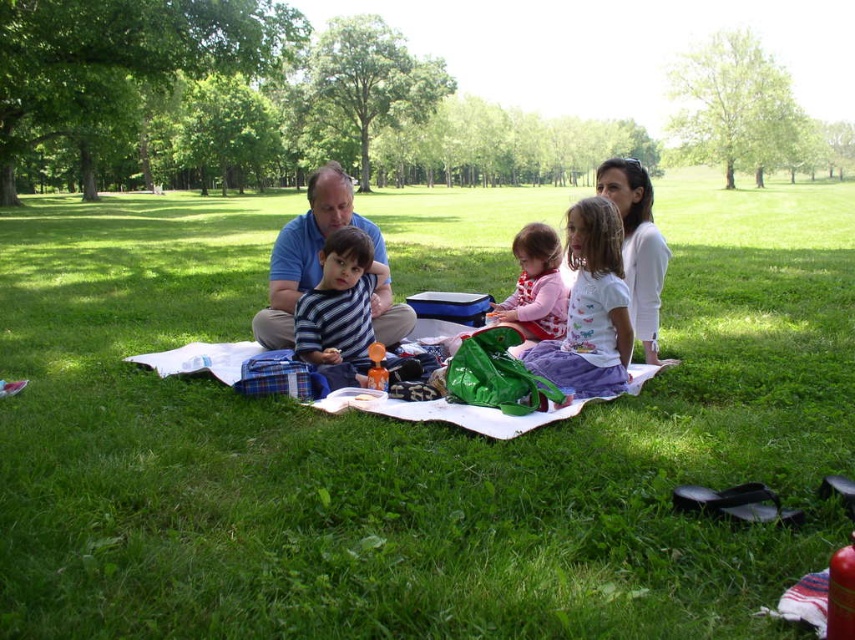
You are a photographer trying to capture a candid shot of the family. You notice the matte blue shirt at center and the striped fabric shirt at center. Which one is positioned higher in the image?

The matte blue shirt at center is located above the striped fabric shirt at center, so the matte blue shirt at center is positioned higher in the image.

You are a photographer trying to capture a photo of the green grass at center and the matte pink shirt at center. Based on their heights, which one should you focus on first if you want to ensure both are in focus?

The green grass at center is taller than the matte pink shirt at center, so you should focus on the green grass at center first to ensure both are in focus.

You are a photographer trying to capture the entire family in one photo. The blue cotton shirt at center and the matte blue shirt at center are both in the frame. Which shirt should you focus on to ensure both shirts are fully visible in the photo?

The blue cotton shirt at center occupies less space than matte blue shirt at center, so focusing on the matte blue shirt at center would ensure both are fully visible as it takes up more space in the frame.